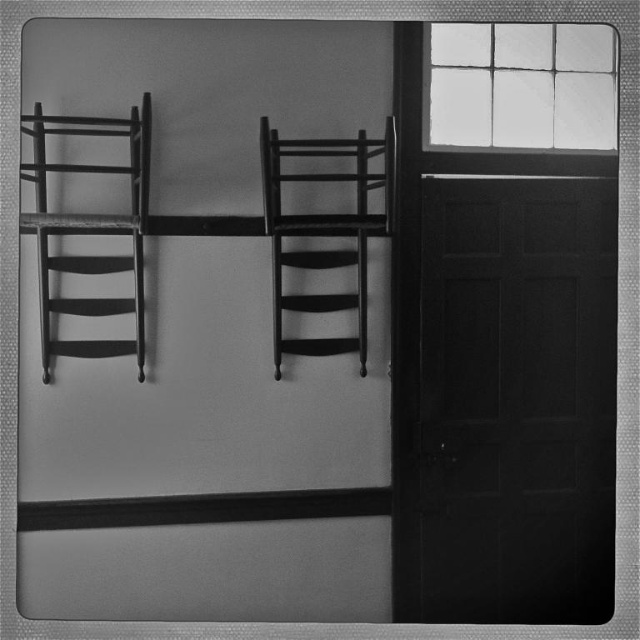
From the picture: You are standing in the room shown in the image and want to look out the window. The point marked at coordinates point (522, 84) is part of the window. Based on the coordinates, in which direction should you look to see the glass paneled window at upper right?

The point marked at coordinates point (522, 84) corresponds to the glass paneled window at upper right, so you should look towards the upper right direction to see the glass paneled window at upper right.

You are standing in a room with two wooden chairs against the wall and a door. You want to look out the glass paneled window at upper right. In which direction should you turn your head to see it?

The glass paneled window at upper right is located at coordinates 0.134 on the x axis and 0.817 on the y axis, so you should turn your head to the upper right direction to see it.

You are standing in a room with two wooden chairs positioned against the wall. You need to exit through the door but first want to check if the smooth black door at right is above or below the glass paneled window at upper right. Can you determine this based on the scene?

The smooth black door at right is located below the glass paneled window at upper right, so the door is below the window.